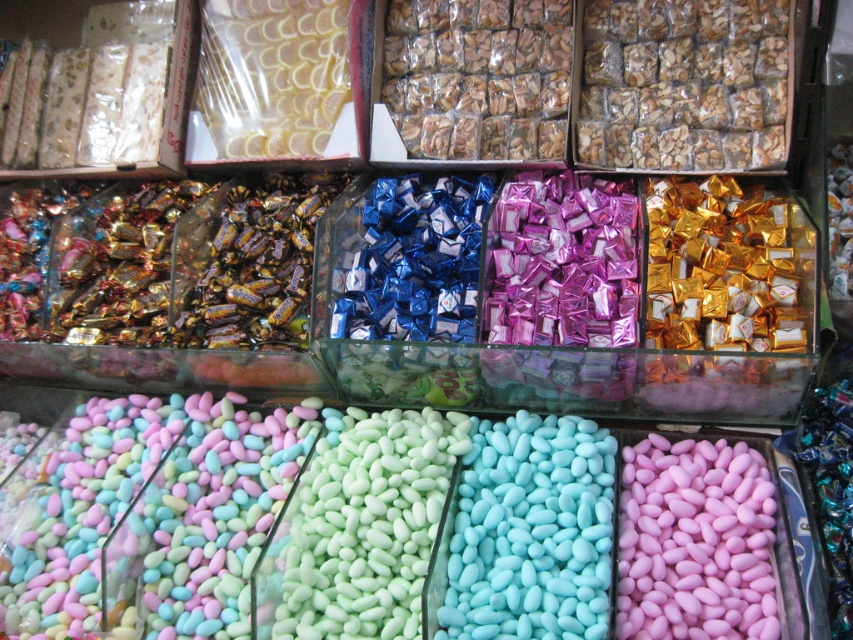
Does blue matte candy at center have a lesser width compared to pink matte candy at lower right?

In fact, blue matte candy at center might be wider than pink matte candy at lower right.

Which of these two, blue matte candy at center or pink matte candy at lower right, stands shorter?

Standing shorter between the two is pink matte candy at lower right.

Is point (498, 602) less distant than point (662, 612)?

That is True.

Where is `blue matte candy at center`? blue matte candy at center is located at coordinates (531, 531).